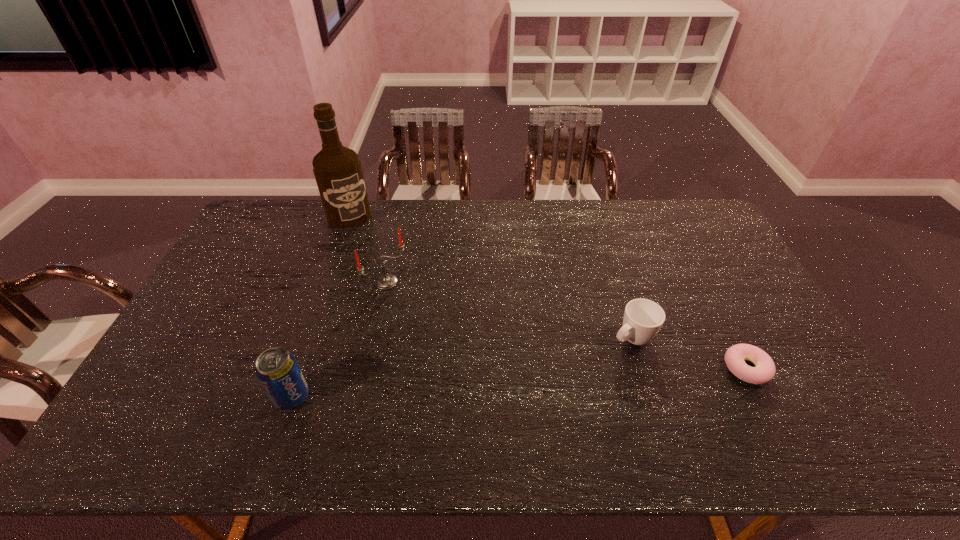
Identify the location of object that is at the far edge. The width and height of the screenshot is (960, 540). (337, 169).

Where is `soda situated at the near edge`? This screenshot has width=960, height=540. soda situated at the near edge is located at coordinates (277, 370).

You are a GUI agent. You are given a task and a screenshot of the screen. Output one action in this format:
    pyautogui.click(x=<x>, y=<y>)
    Task: Click on the doughnut situated at the near edge
    
    Given the screenshot: What is the action you would take?
    pyautogui.click(x=764, y=371)

You are a GUI agent. You are given a task and a screenshot of the screen. Output one action in this format:
    pyautogui.click(x=<x>, y=<y>)
    Task: Click on the object that is at the right edge
    
    Given the screenshot: What is the action you would take?
    pyautogui.click(x=764, y=371)

The image size is (960, 540). I want to click on object that is positioned at the near right corner, so click(x=764, y=371).

In the image, there is a desktop. Where is `vacant space at the far edge`? This screenshot has width=960, height=540. vacant space at the far edge is located at coordinates (612, 214).

You are a GUI agent. You are given a task and a screenshot of the screen. Output one action in this format:
    pyautogui.click(x=<x>, y=<y>)
    Task: Click on the vacant space at the near edge of the desktop
    The height and width of the screenshot is (540, 960).
    Given the screenshot: What is the action you would take?
    pyautogui.click(x=732, y=388)

Locate an element on the screen. free region at the left edge of the desktop is located at coordinates (225, 273).

The height and width of the screenshot is (540, 960). In order to click on vacant space at the right edge of the desktop in this screenshot , I will do `click(736, 320)`.

At what (x,y) coordinates should I click in order to perform the action: click on free space at the far right corner. Please return your answer as a coordinate pair (x, y). Looking at the image, I should click on (689, 229).